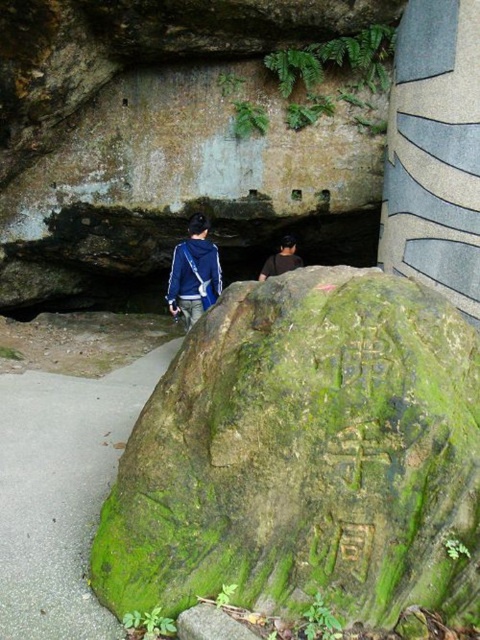
You are a tour guide leading a group near the large mossy rock. You notice two visitors wearing jackets at the center of your view. The jackets are a blue fabric jacket at center and a dark brown leather jacket at center. You need to ensure they maintain a safe distance of at least 1 meter apart for safety. Are they currently following this guideline?

The distance between the blue fabric jacket at center and the dark brown leather jacket at center is 84.47 centimeters, which is less than the required 1 meter. Therefore, they are not maintaining the safe distance guideline.

What is the spatial relationship between the green mossy rock at center and the dark brown leather jacket at center?

The green mossy rock at center is to the left of the dark brown leather jacket at center.

You are a hiker who wants to take a photo of the green mossy rock at center and the dark brown leather jacket at center together in the frame. Based on their distance, will you need to zoom in or zoom out to include both in the shot?

The green mossy rock at center and dark brown leather jacket at center are 4.12 meters apart. To include both in the frame, you would need to zoom out to widen the field of view.